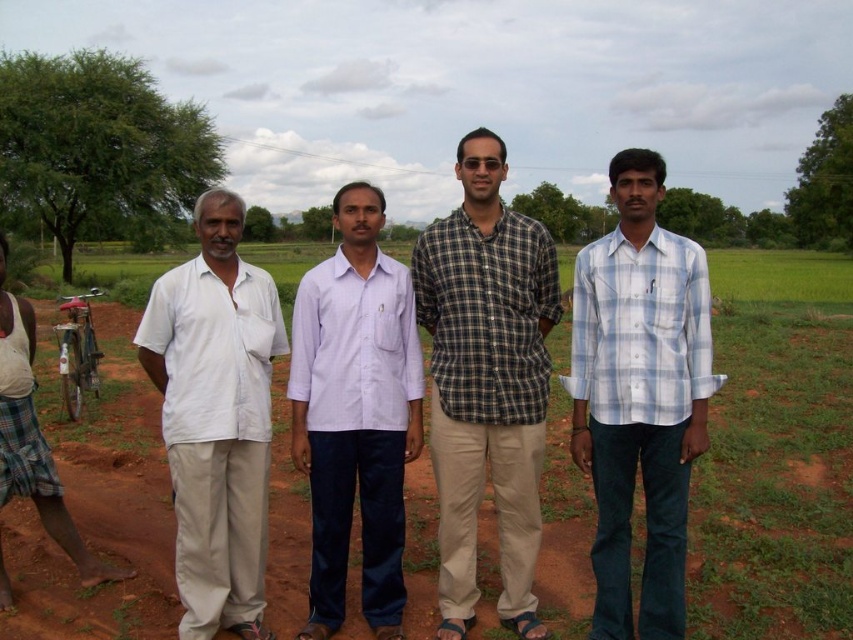
Question: Is checkered fabric shirt at center further to camera compared to white cotton shirt at left?

Choices:
 (A) yes
 (B) no

Answer: (A)

Question: Which of the following is the closest to the observer?

Choices:
 (A) brown dirt field at center
 (B) white cotton shirt at left
 (C) metallic bicycle at left
 (D) light purple cotton shirt at center

Answer: (B)

Question: Which of the following is the farthest from the observer?

Choices:
 (A) (717, 481)
 (B) (265, 497)
 (C) (99, 563)
 (D) (650, 624)

Answer: (A)

Question: Does checkered fabric shirt at center have a smaller size compared to light purple cotton shirt at center?

Choices:
 (A) yes
 (B) no

Answer: (B)

Question: Which of the following is the closest to the observer?

Choices:
 (A) checkered fabric shirt at center
 (B) brown dirt field at center

Answer: (A)

Question: Does light blue plaid shirt at center have a smaller size compared to metallic bicycle at left?

Choices:
 (A) no
 (B) yes

Answer: (A)